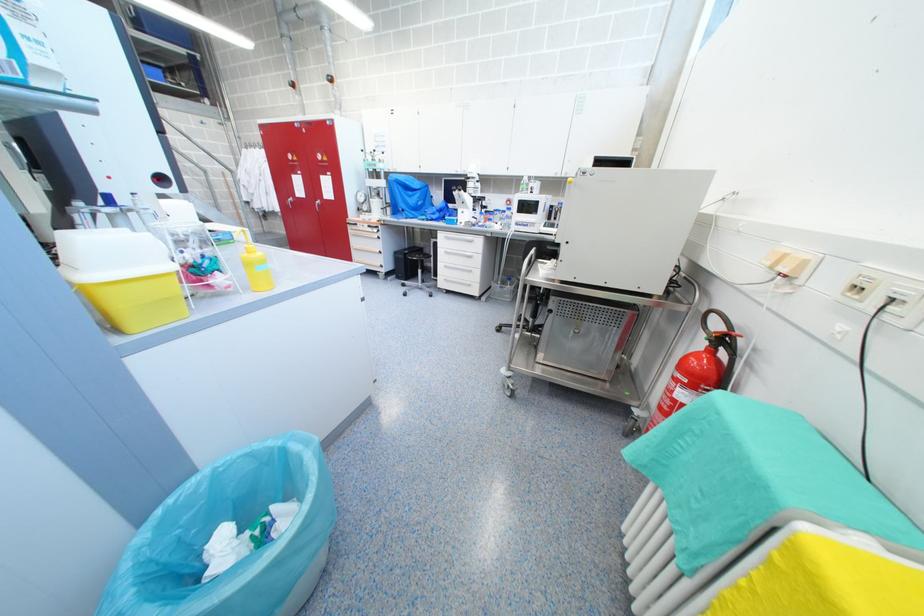
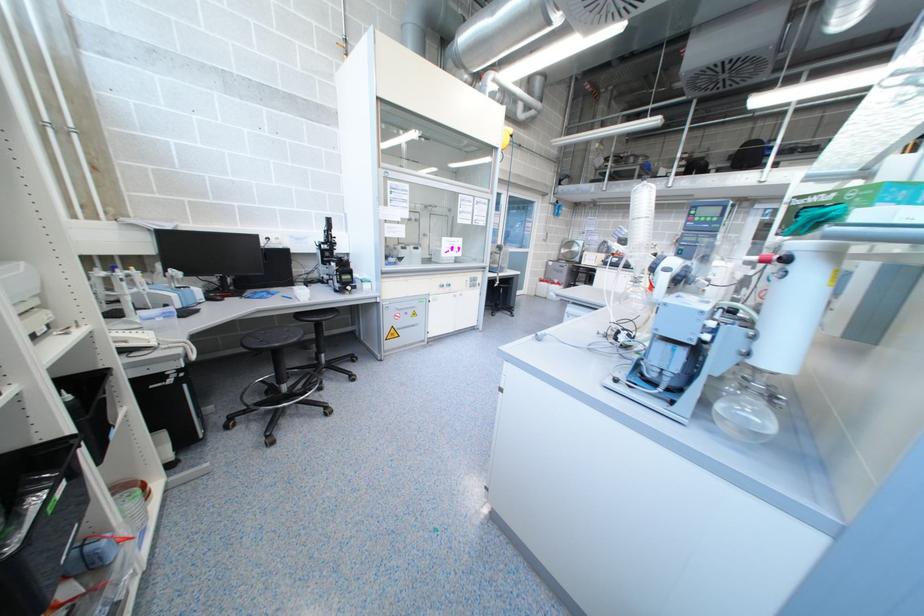
Based on the continuous images, in which direction is the camera rotating?

The rotation direction of the camera is left-down.